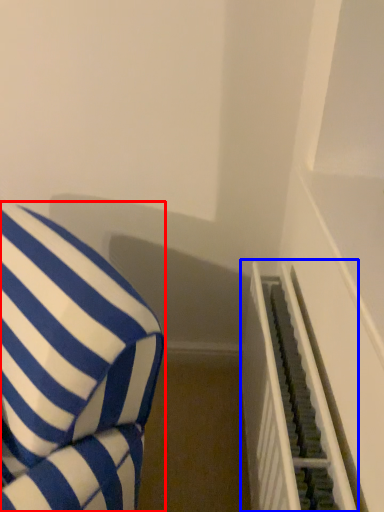
Question: Which object appears farthest to the camera in this image, furniture (highlighted by a red box) or stairwell (highlighted by a blue box)?

Choices:
 (A) furniture
 (B) stairwell

Answer: (B)